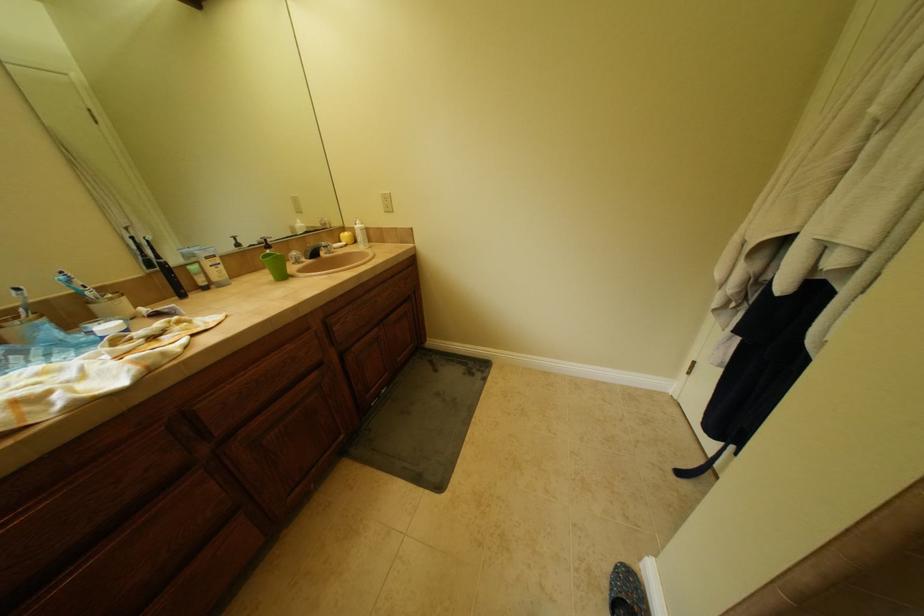
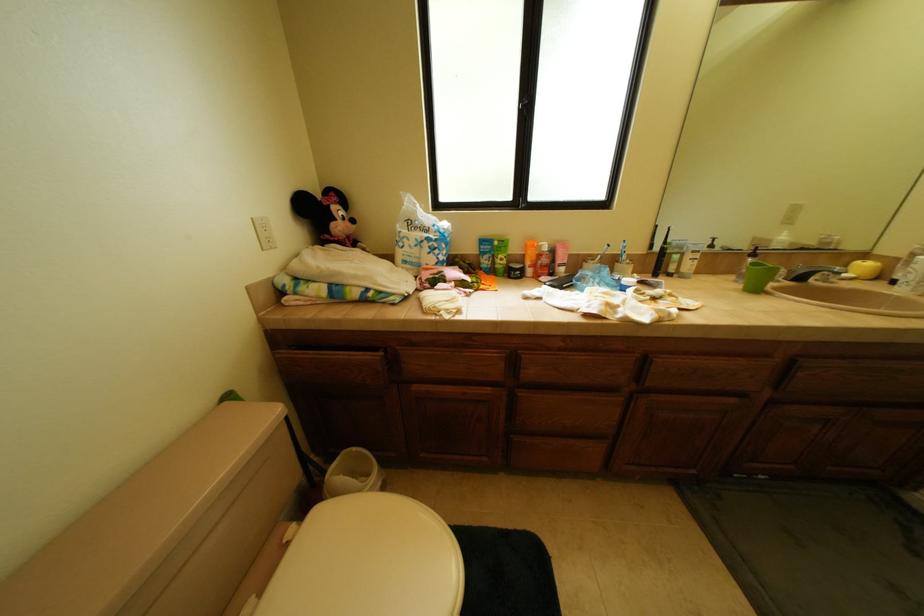
The first image is from the beginning of the video and the second image is from the end. How did the camera likely rotate when shooting the video?

The rotation direction of the camera is left-down.